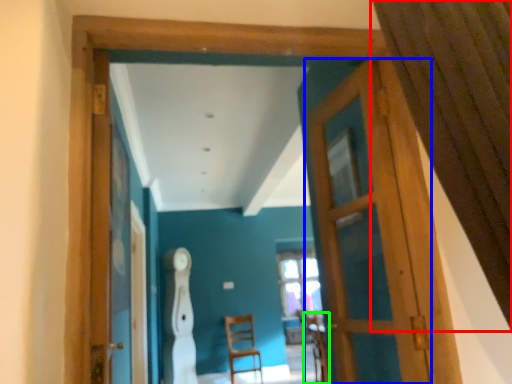
Question: Which is farther away from curtain (highlighted by a red box)? door (highlighted by a blue box) or armchair (highlighted by a green box)?

Choices:
 (A) door
 (B) armchair

Answer: (B)